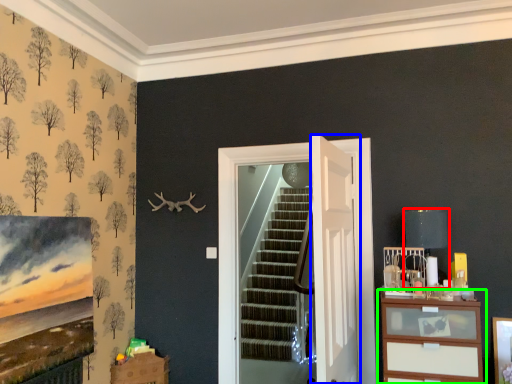
Question: Estimate the real-world distances between objects in this image. Which object is farther from lamp (highlighted by a red box), door (highlighted by a blue box) or chest of drawers (highlighted by a green box)?

Choices:
 (A) door
 (B) chest of drawers

Answer: (A)